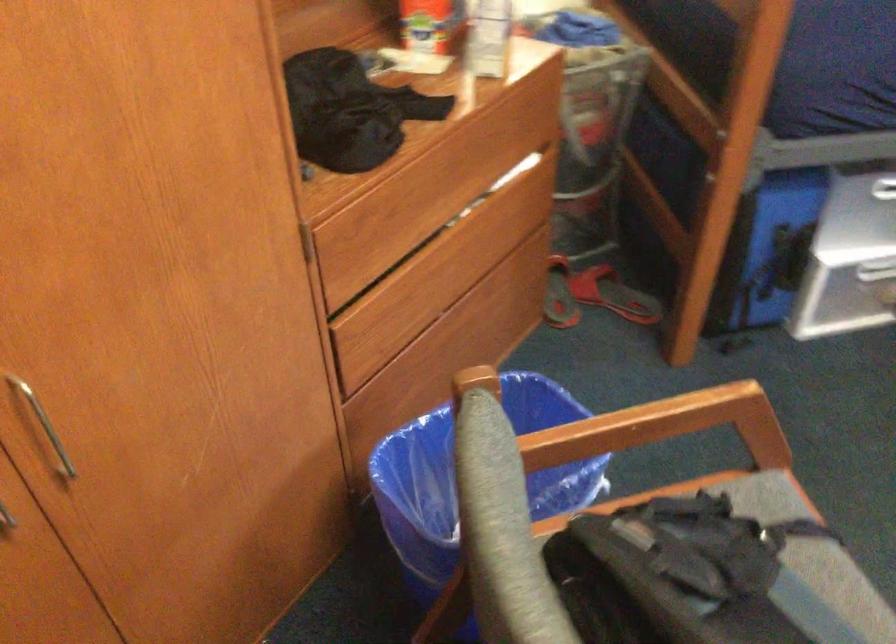
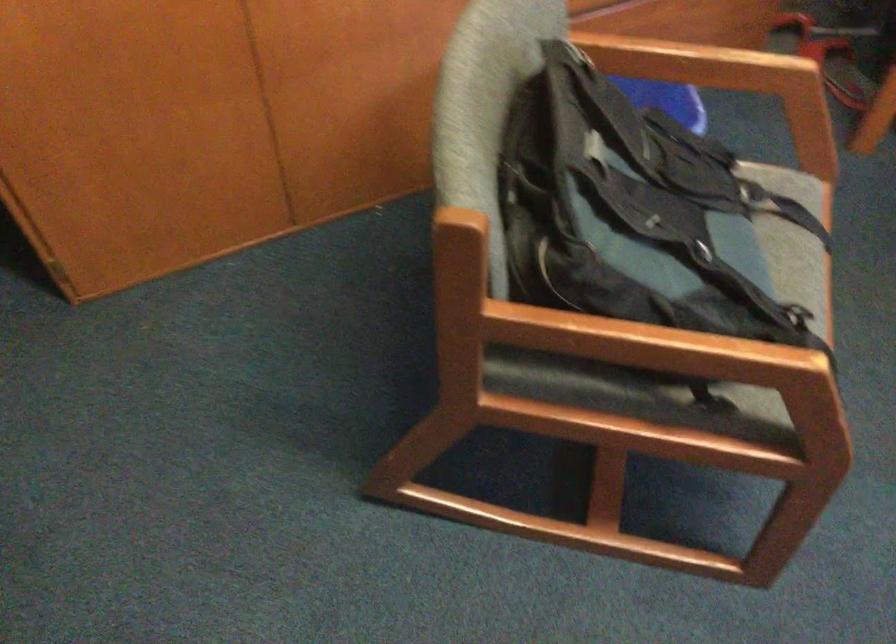
Question: The first image is from the beginning of the video and the second image is from the end. How did the camera likely rotate when shooting the video?

Choices:
 (A) Left
 (B) Right
 (C) Up
 (D) Down

Answer: (D)